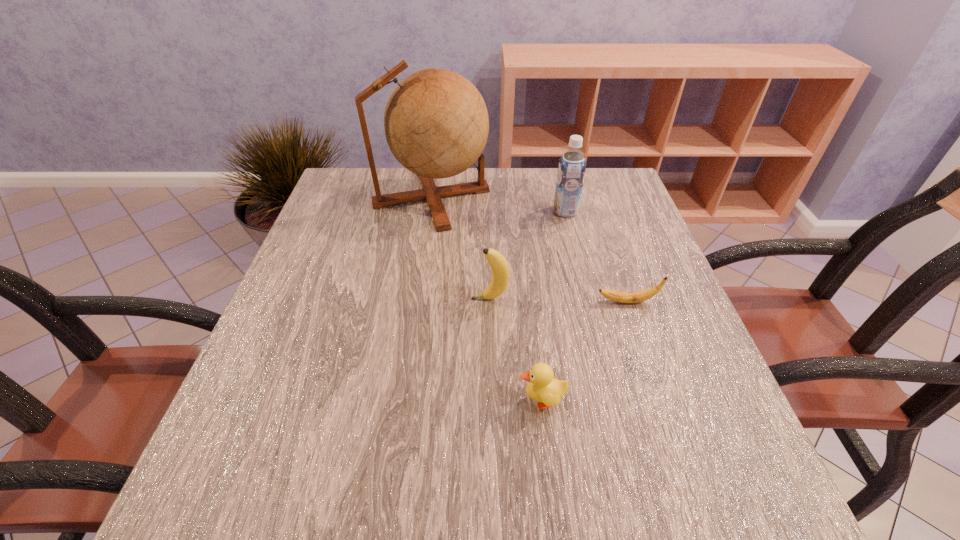
The image size is (960, 540). In order to click on globe in this screenshot , I will do [436, 123].

Locate an element on the screen. This screenshot has height=540, width=960. soya milk is located at coordinates (571, 171).

Identify the location of the left banana. The image size is (960, 540). (500, 269).

The width and height of the screenshot is (960, 540). I want to click on the taller banana, so click(x=500, y=269).

Identify the location of duckling. (542, 387).

Where is `the third object from right to left`? This screenshot has width=960, height=540. the third object from right to left is located at coordinates (x=542, y=387).

I want to click on the shorter banana, so click(618, 296).

Identify the location of the shortest object. Image resolution: width=960 pixels, height=540 pixels. (618, 296).

Where is `free region located 0.330m on the surface of the tallest object`? This screenshot has height=540, width=960. free region located 0.330m on the surface of the tallest object is located at coordinates (614, 197).

The width and height of the screenshot is (960, 540). I want to click on vacant space located 0.230m on the label of the second tallest object, so click(464, 211).